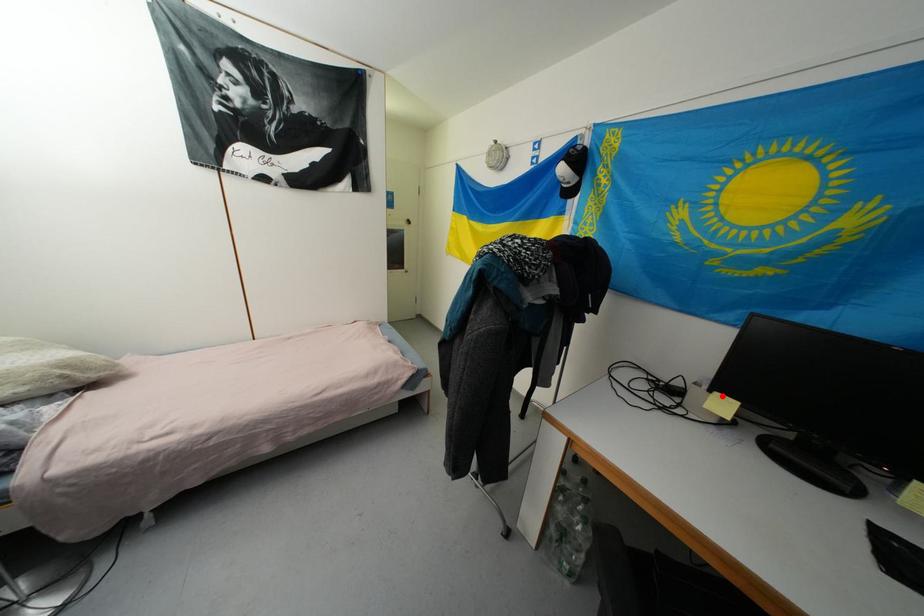
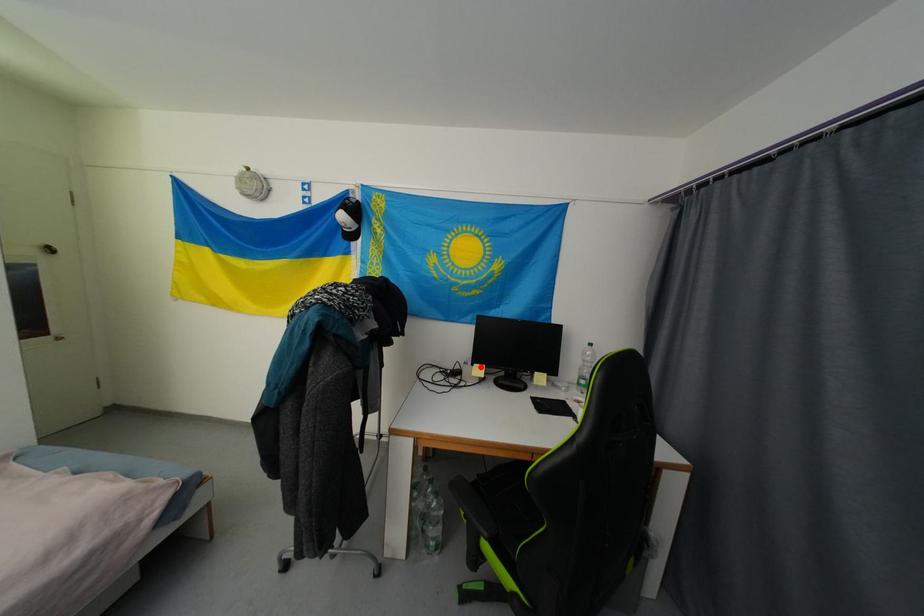
I am providing you with two images of the same scene from different viewpoints. A red point is marked on the first image and another point is marked on the second image. Is the red point in image1 aligned with the point shown in image2?

Yes